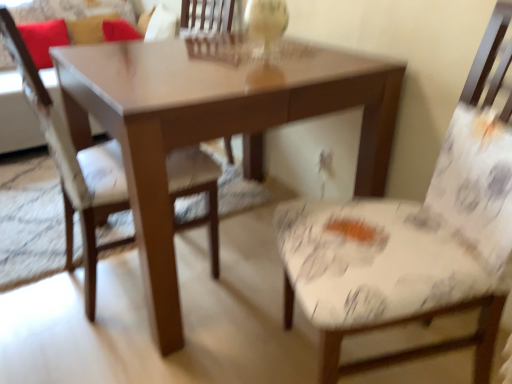
Question: In terms of width, does matte brown table at center look wider or thinner when compared to red fabric pillow at upper left, which is counted as the second pillow, starting from the right?

Choices:
 (A) wide
 (B) thin

Answer: (A)

Question: Choose the correct answer: Is matte brown table at center inside red fabric pillow at upper left, which ranks as the 1th pillow in left-to-right order, or outside it?

Choices:
 (A) inside
 (B) outside

Answer: (B)

Question: Which object is the farthest from the white floral fabric chair at right, which ranks as the 2th chair in left-to-right order?

Choices:
 (A) velvet red couch at upper left
 (B) red fabric pillow at upper left, which ranks as the 1th pillow in left-to-right order
 (C) matte brown table at center
 (D) patterned fabric chair at left, the 2th chair viewed from the right
 (E) velvet red pillow at upper left, the first pillow positioned from the right

Answer: (E)

Question: Which object is positioned closest to the white floral fabric chair at right, which ranks as the 2th chair in left-to-right order?

Choices:
 (A) velvet red pillow at upper left, the first pillow positioned from the right
 (B) velvet red couch at upper left
 (C) matte brown table at center
 (D) patterned fabric chair at left, the 2th chair viewed from the right
 (E) red fabric pillow at upper left, which is counted as the second pillow, starting from the right

Answer: (C)